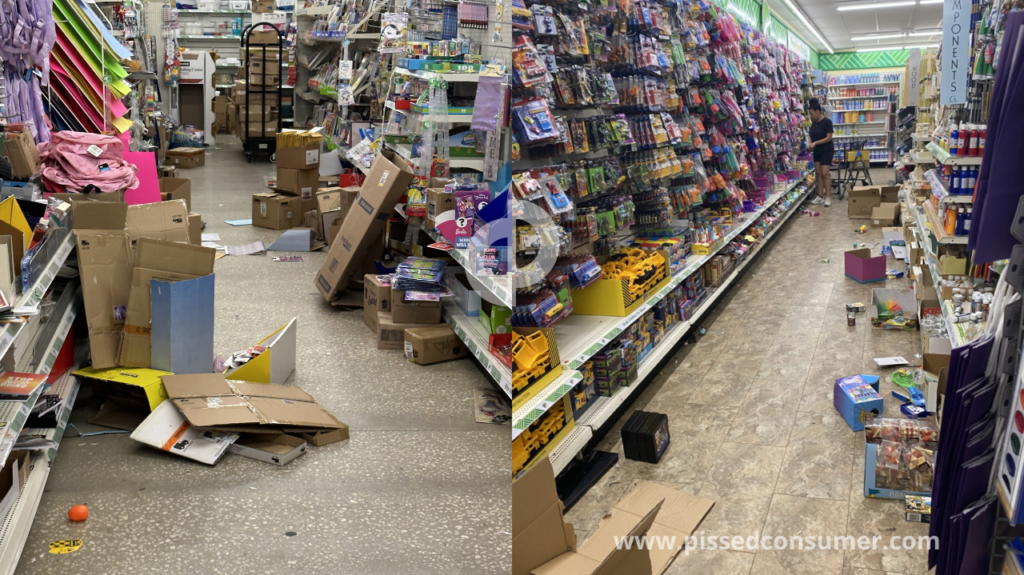
Image resolution: width=1024 pixels, height=575 pixels. I want to click on ceiling fluorescent lights, so click(872, 3), click(874, 34), click(817, 38).